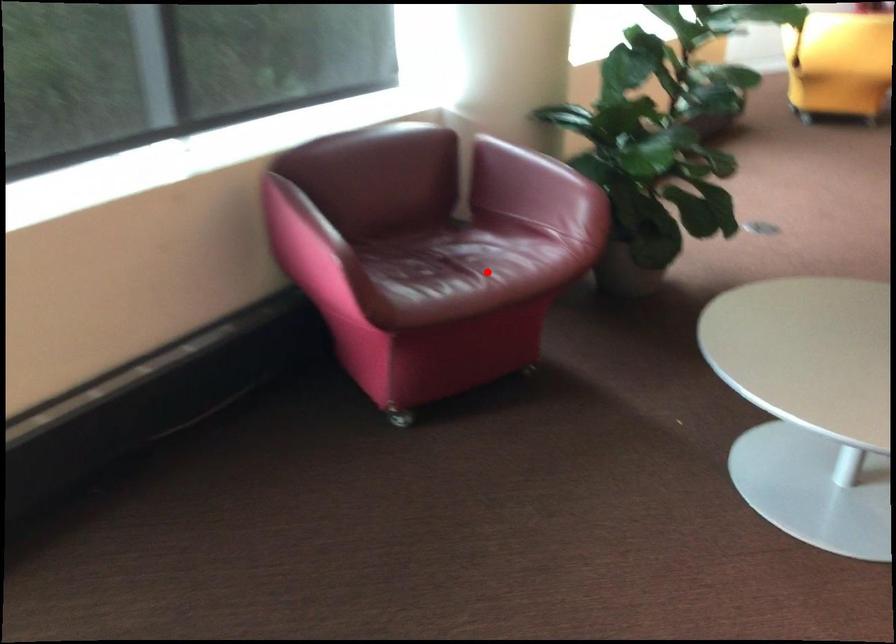
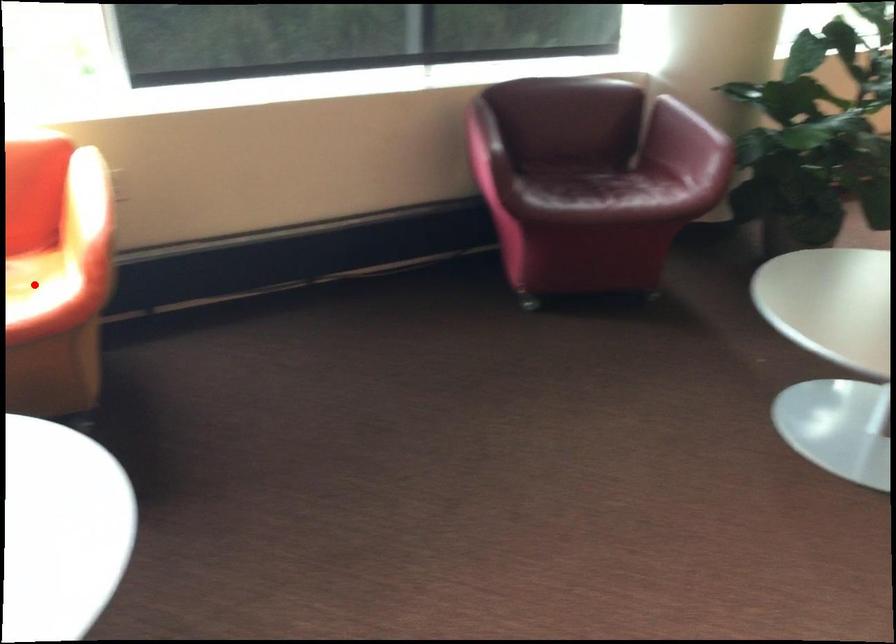
I am providing you with two images of the same scene from different viewpoints. A red point is marked on the first image and another point is marked on the second image. Does the point marked in image1 correspond to the same location as the one in image2?

No